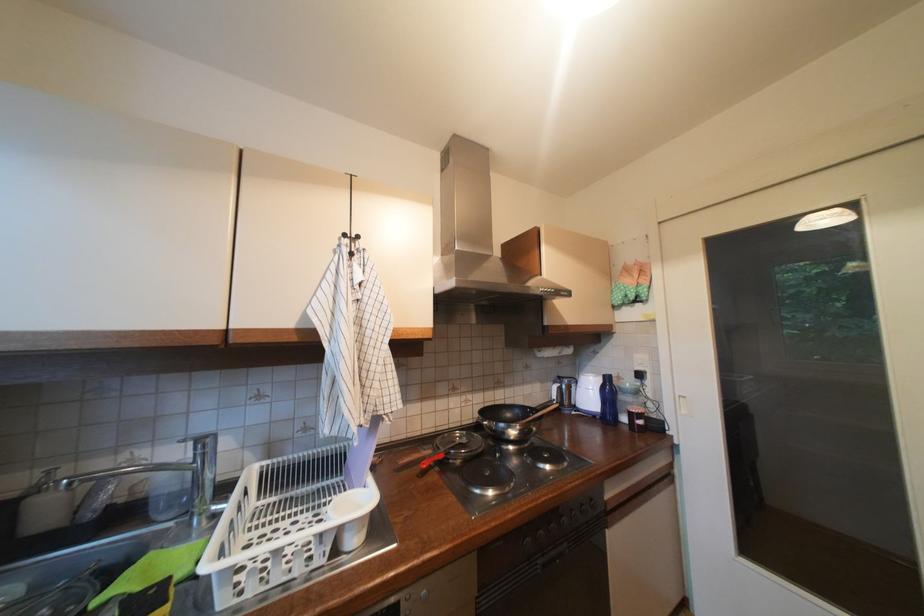
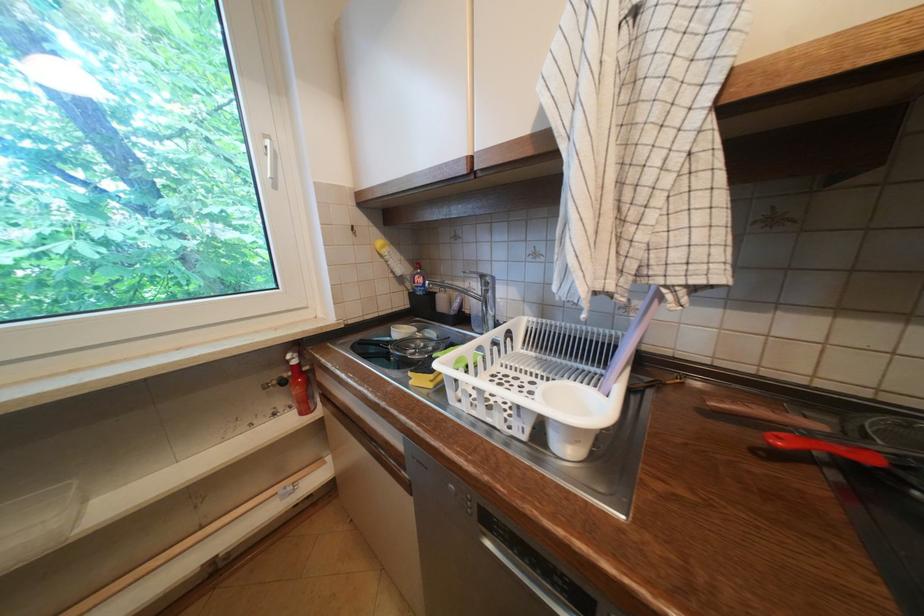
Locate, in the second image, the point that corresponds to the point at 432,464 in the first image.

(788, 440)